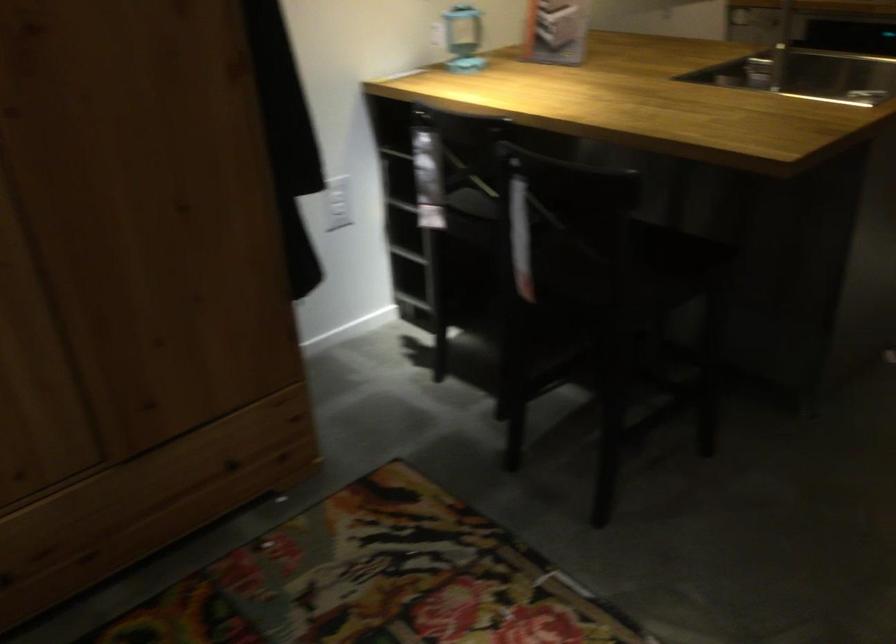
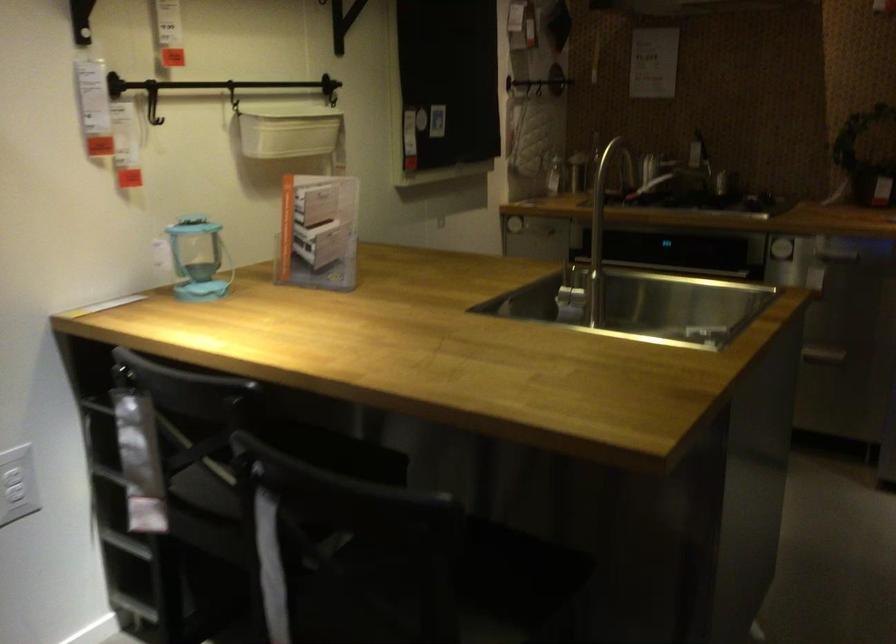
Question: Which direction would the cameraman need to move to produce the second image? Reply with the corresponding letter.

Choices:
 (A) Left
 (B) Right
 (C) Forward
 (D) Backward

Answer: (C)